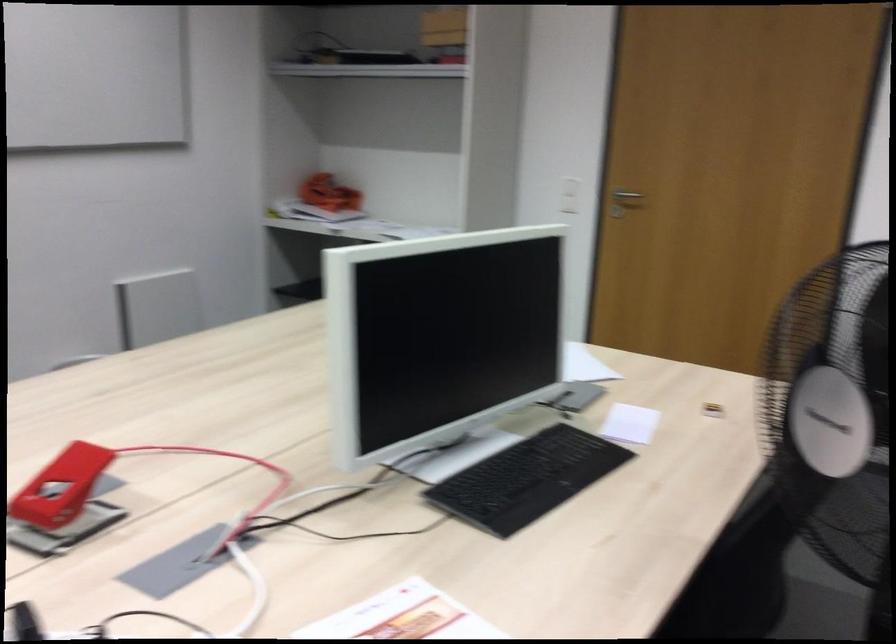
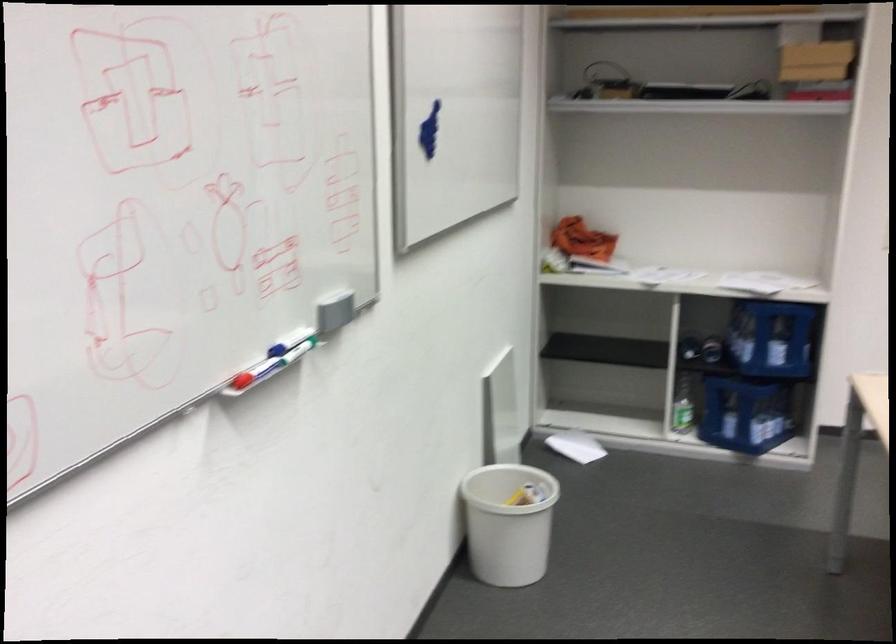
Where in the second image is the point corresponding to (x=409, y=212) from the first image?

(660, 275)